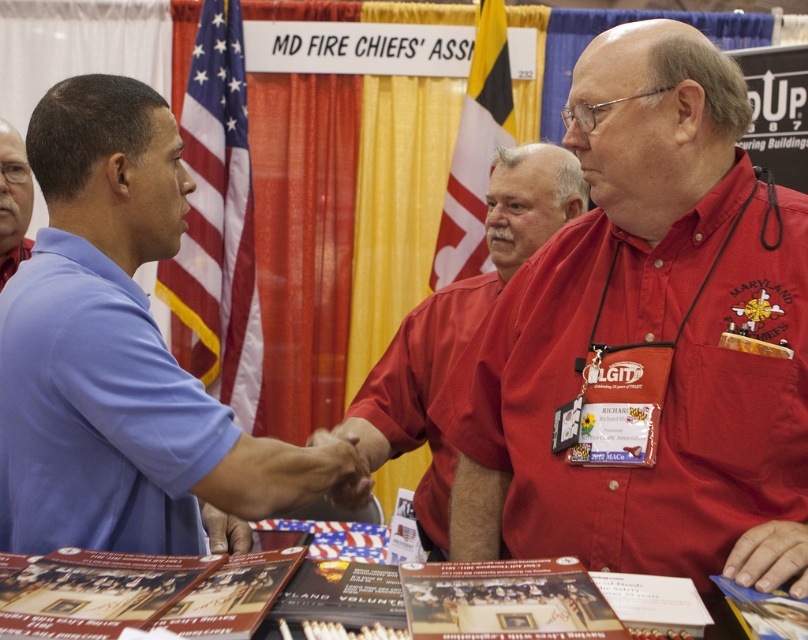
Is point (537, 337) closer to viewer compared to point (226, 401)?

Yes.

Which is above, matte red shirt at center or american flag at left?

american flag at left

Between point (668, 320) and point (181, 257), which one is positioned in front?

Point (668, 320) is in front.

Find the location of a particular element. This screenshot has width=808, height=640. matte red shirt at center is located at coordinates click(646, 330).

Where is `blue cotton shirt at center`? Image resolution: width=808 pixels, height=640 pixels. blue cotton shirt at center is located at coordinates (118, 353).

Does blue cotton shirt at center lie in front of yellow fabric flag at upper center?

Yes, it is in front of yellow fabric flag at upper center.

Is point (121, 362) behind point (478, 109)?

No, (121, 362) is in front of (478, 109).

Where is `blue cotton shirt at center`? This screenshot has height=640, width=808. blue cotton shirt at center is located at coordinates (118, 353).

Is american flag at left bigger than red smooth shirt at center?

No, american flag at left is not bigger than red smooth shirt at center.

Is american flag at left behind red smooth shirt at center?

Yes, american flag at left is further from the viewer.

I want to click on american flag at left, so click(x=217, y=225).

The width and height of the screenshot is (808, 640). I want to click on american flag at left, so click(x=217, y=225).